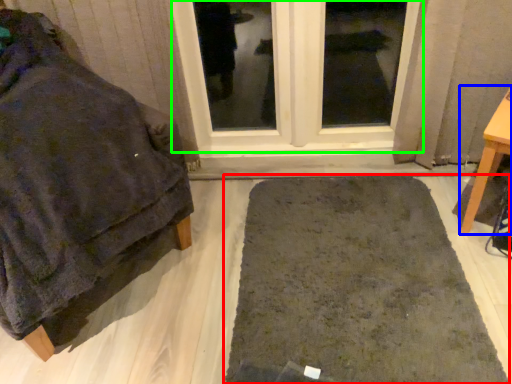
Question: Estimate the real-world distances between objects in this image. Which object is closer to bath mat (highlighted by a red box), furniture (highlighted by a blue box) or window (highlighted by a green box)?

Choices:
 (A) furniture
 (B) window

Answer: (A)